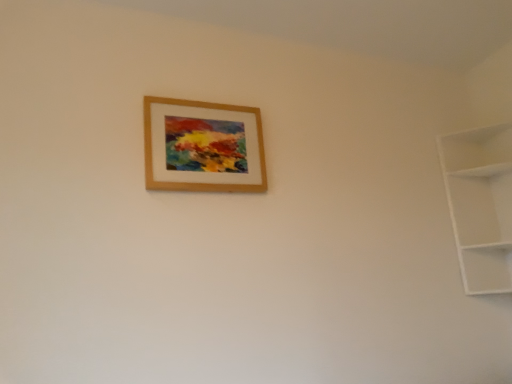
Image resolution: width=512 pixels, height=384 pixels. In order to click on white matte shelf at right in this screenshot , I will do `click(480, 204)`.

Describe the element at coordinates (480, 204) in the screenshot. This screenshot has height=384, width=512. I see `white matte shelf at right` at that location.

Image resolution: width=512 pixels, height=384 pixels. What do you see at coordinates (203, 147) in the screenshot? I see `wooden picture frame at upper center` at bounding box center [203, 147].

The image size is (512, 384). In order to click on wooden picture frame at upper center in this screenshot , I will do `click(203, 147)`.

The width and height of the screenshot is (512, 384). In order to click on white matte shelf at right in this screenshot , I will do `click(480, 204)`.

Considering the positions of objects wooden picture frame at upper center and white matte shelf at right in the image provided, who is more to the left, wooden picture frame at upper center or white matte shelf at right?

wooden picture frame at upper center.

In the image, is wooden picture frame at upper center positioned in front of or behind white matte shelf at right?

In the image, wooden picture frame at upper center appears in front of white matte shelf at right.

Does point (209, 124) appear closer or farther from the camera than point (470, 289)?

Clearly, point (209, 124) is closer to the camera than point (470, 289).

From the image's perspective, is wooden picture frame at upper center located above or below white matte shelf at right?

wooden picture frame at upper center is above white matte shelf at right.

From a real-world perspective, which object stands above the other?

wooden picture frame at upper center is physically above.

In terms of width, does wooden picture frame at upper center look wider or thinner when compared to white matte shelf at right?

wooden picture frame at upper center is thinner than white matte shelf at right.

From their relative heights in the image, would you say wooden picture frame at upper center is taller or shorter than white matte shelf at right?

Clearly, wooden picture frame at upper center is shorter compared to white matte shelf at right.

Which of these two, wooden picture frame at upper center or white matte shelf at right, is bigger?

white matte shelf at right is bigger.

Consider the image. Is wooden picture frame at upper center located outside white matte shelf at right?

Yes, wooden picture frame at upper center is not within white matte shelf at right.

Is there a large distance between wooden picture frame at upper center and white matte shelf at right?

wooden picture frame at upper center is positioned a significant distance from white matte shelf at right.

Is wooden picture frame at upper center positioned with its back to white matte shelf at right?

No, wooden picture frame at upper center's orientation is not away from white matte shelf at right.

What's the angular difference between wooden picture frame at upper center and white matte shelf at right's facing directions?

The angle between the facing direction of wooden picture frame at upper center and the facing direction of white matte shelf at right is 90 degrees.

Identify the location of shelf that is behind the wooden picture frame at upper center. (480, 204).

Would you say white matte shelf at right is to the left or to the right of wooden picture frame at upper center in the picture?

Clearly, white matte shelf at right is on the right of wooden picture frame at upper center in the image.

Which object is closer to the camera taking this photo, white matte shelf at right or wooden picture frame at upper center?

wooden picture frame at upper center is closer to the camera.

Is point (480, 229) less distant than point (165, 133)?

No, it is not.

From the image's perspective, would you say white matte shelf at right is shown under wooden picture frame at upper center?

Correct, white matte shelf at right appears lower than wooden picture frame at upper center in the image.

From a real-world perspective, is white matte shelf at right physically located above or below wooden picture frame at upper center?

white matte shelf at right is below wooden picture frame at upper center.

Is white matte shelf at right wider than wooden picture frame at upper center?

Correct, the width of white matte shelf at right exceeds that of wooden picture frame at upper center.

Which of these two, white matte shelf at right or wooden picture frame at upper center, stands taller?

Standing taller between the two is white matte shelf at right.

Is white matte shelf at right bigger or smaller than wooden picture frame at upper center?

Considering their sizes, white matte shelf at right takes up more space than wooden picture frame at upper center.

Would you say wooden picture frame at upper center is part of white matte shelf at right's contents?

Definitely not — wooden picture frame at upper center is not inside white matte shelf at right.

Is there a large distance between white matte shelf at right and wooden picture frame at upper center?

white matte shelf at right is positioned a significant distance from wooden picture frame at upper center.

Is white matte shelf at right oriented towards wooden picture frame at upper center?

Yes.

How many degrees apart are the facing directions of white matte shelf at right and wooden picture frame at upper center?

The angular difference between white matte shelf at right and wooden picture frame at upper center is 90 degrees.

Measure the distance between white matte shelf at right and wooden picture frame at upper center.

They are 3.42 feet apart.

Where is `shelf behind the wooden picture frame at upper center`? The image size is (512, 384). shelf behind the wooden picture frame at upper center is located at coordinates (480, 204).

What are the coordinates of `picture frame on the left of the white matte shelf at right` in the screenshot? It's located at (203, 147).

Find the location of a particular element. picture frame in front of the white matte shelf at right is located at coordinates (203, 147).